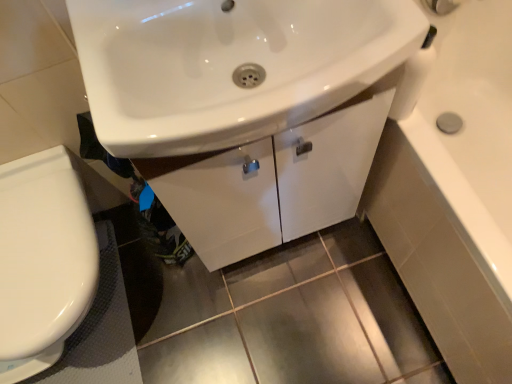
Question: Is black rubber bath mat at lower left not close to white glossy cabinet at center?

Choices:
 (A) yes
 (B) no

Answer: (B)

Question: Does black rubber bath mat at lower left turn towards white glossy cabinet at center?

Choices:
 (A) yes
 (B) no

Answer: (B)

Question: Can you confirm if black rubber bath mat at lower left is smaller than white glossy cabinet at center?

Choices:
 (A) yes
 (B) no

Answer: (A)

Question: Is black rubber bath mat at lower left bigger than white glossy cabinet at center?

Choices:
 (A) yes
 (B) no

Answer: (B)

Question: Is black rubber bath mat at lower left behind white glossy cabinet at center?

Choices:
 (A) yes
 (B) no

Answer: (A)

Question: Is black rubber bath mat at lower left next to white glossy cabinet at center?

Choices:
 (A) no
 (B) yes

Answer: (A)

Question: Can you confirm if white glossy toilet at lower left is smaller than white glossy cabinet at center?

Choices:
 (A) no
 (B) yes

Answer: (B)

Question: Does white glossy toilet at lower left appear on the right side of white glossy cabinet at center?

Choices:
 (A) yes
 (B) no

Answer: (B)

Question: Is white glossy toilet at lower left far from white glossy cabinet at center?

Choices:
 (A) no
 (B) yes

Answer: (A)

Question: Does white glossy toilet at lower left have a greater height compared to white glossy cabinet at center?

Choices:
 (A) yes
 (B) no

Answer: (B)

Question: From a real-world perspective, is white glossy toilet at lower left positioned under white glossy cabinet at center based on gravity?

Choices:
 (A) yes
 (B) no

Answer: (A)

Question: Is white glossy toilet at lower left wider than white glossy cabinet at center?

Choices:
 (A) yes
 (B) no

Answer: (A)

Question: Does white glossy toilet at lower left touch white glossy sink at center?

Choices:
 (A) no
 (B) yes

Answer: (A)